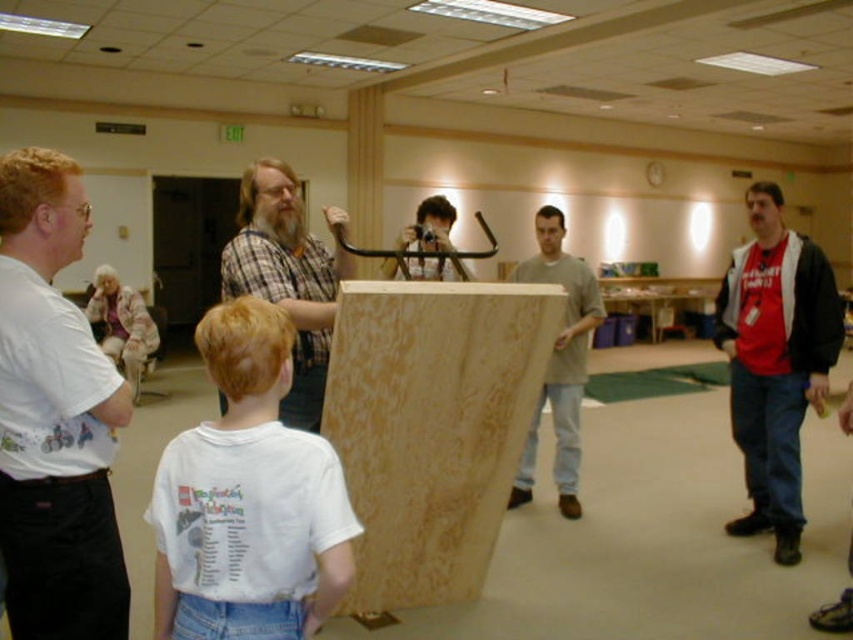
This screenshot has height=640, width=853. Identify the location of birch plywood at center. (432, 426).

Is point (548, 310) positioned before point (529, 465)?

That is True.

Is point (473, 529) closer to viewer compared to point (515, 275)?

Yes, point (473, 529) is in front of point (515, 275).

Where is `birch plywood at center`? birch plywood at center is located at coordinates (432, 426).

Is birch plywood at center to the right of red cotton t-shirt at right from the viewer's perspective?

Incorrect, birch plywood at center is not on the right side of red cotton t-shirt at right.

Who is more forward, (387, 472) or (747, 260)?

Positioned in front is point (387, 472).

Is point (515, 340) in front of point (762, 518)?

Yes.

The width and height of the screenshot is (853, 640). Identify the location of birch plywood at center. (432, 426).

Between white cotton shirt at left and red cotton t-shirt at right, which one appears on the left side from the viewer's perspective?

white cotton shirt at left

Who is more forward, (73, 452) or (788, 282)?

Point (73, 452) is more forward.

You are a GUI agent. You are given a task and a screenshot of the screen. Output one action in this format:
    pyautogui.click(x=<x>, y=<y>)
    Task: Click on the white cotton shirt at left
    This screenshot has height=640, width=853.
    Given the screenshot: What is the action you would take?
    pyautogui.click(x=54, y=417)